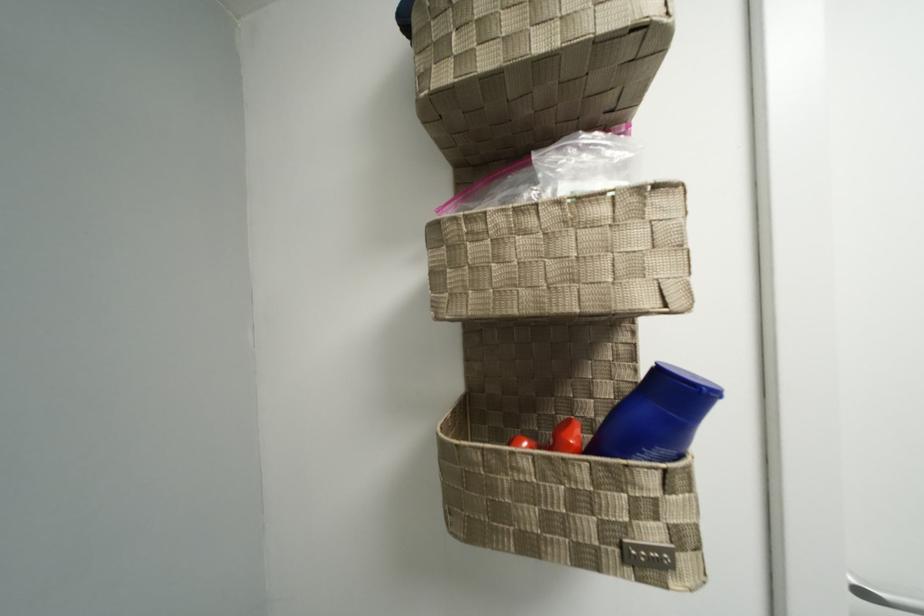
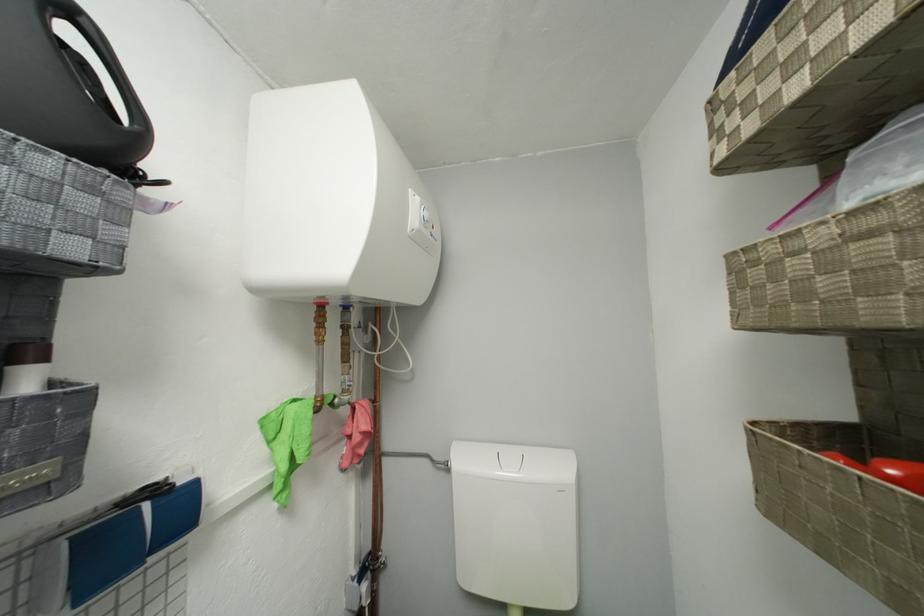
Locate, in the second image, the point that corresponds to (492,452) in the first image.

(781, 442)